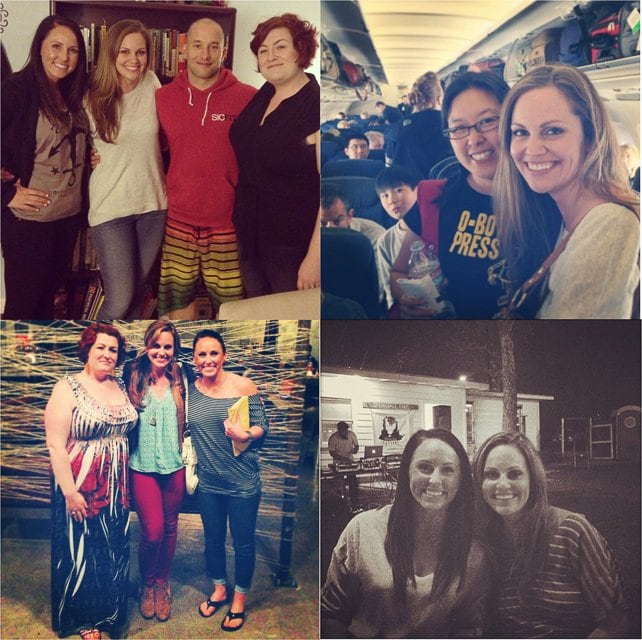
This screenshot has width=642, height=640. I want to click on book shelve, so click(x=171, y=57).